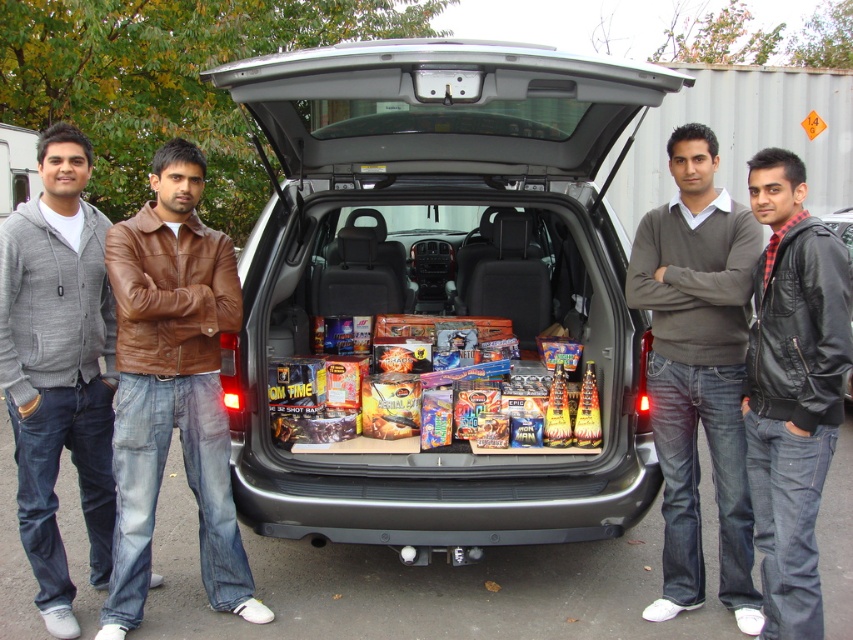
In the scene shown: Who is shorter, black leather jacket at center or black leather jacket at lower right?

black leather jacket at lower right

Who is more distant from viewer, (787, 554) or (845, 225)?

Positioned behind is point (845, 225).

At what (x,y) coordinates should I click in order to perform the action: click on black leather jacket at center. Please return your answer as a coordinate pair (x, y). Looking at the image, I should click on (792, 388).

How far apart are dark gray sweater at center and multicolored cardboard fireworks at center?

A distance of 1.07 meters exists between dark gray sweater at center and multicolored cardboard fireworks at center.

Which of these two, dark gray sweater at center or multicolored cardboard fireworks at center, stands taller?

dark gray sweater at center is taller.

Image resolution: width=853 pixels, height=640 pixels. Identify the location of dark gray sweater at center. (698, 371).

Consider the image. Who is higher up, denim jeans at left or black leather jacket at lower right?

black leather jacket at lower right is higher up.

Who is positioned more to the right, denim jeans at left or black leather jacket at lower right?

Positioned to the right is black leather jacket at lower right.

Measure the distance between denim jeans at left and camera.

A distance of 3.30 meters exists between denim jeans at left and camera.

Where is `denim jeans at left`? denim jeans at left is located at coordinates (57, 365).